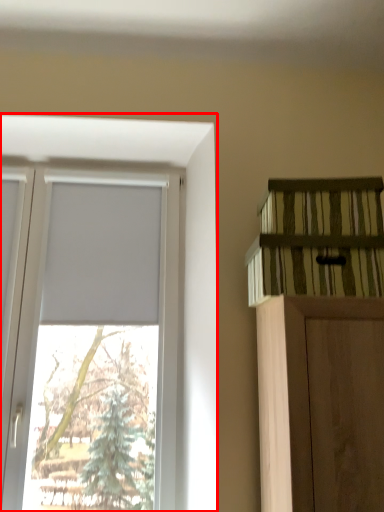
Question: Observing the image, what is the correct spatial positioning of window (annotated by the red box) in reference to shelf?

Choices:
 (A) right
 (B) left

Answer: (B)